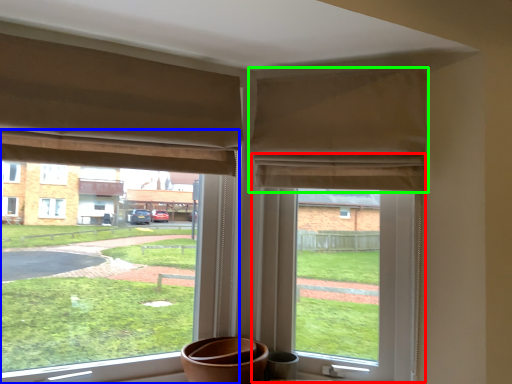
Question: Considering the real-world distances, which object is closest to window screen (highlighted by a red box)? window (highlighted by a blue box) or curtain (highlighted by a green box).

Choices:
 (A) window
 (B) curtain

Answer: (B)